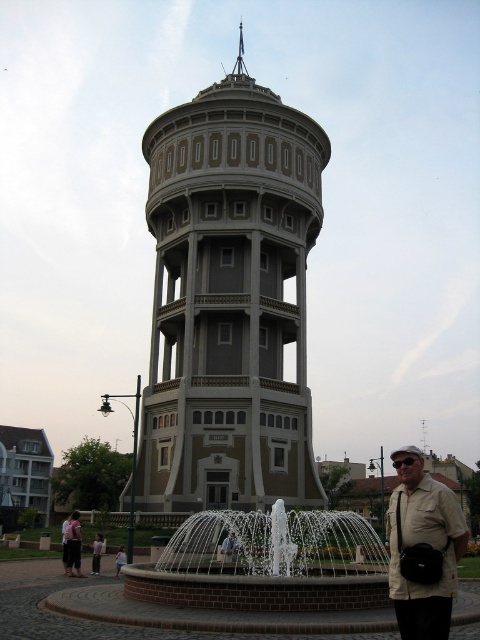
Question: Which is nearer to the light pink fabric dress at lower left?

Choices:
 (A) beige fabric shirt at lower right
 (B) white ceramic fountain at center
 (C) gray concrete tower at center

Answer: (B)

Question: Can you confirm if light pink fabric dress at lower left is positioned above light blue denim jeans at lower center?

Choices:
 (A) yes
 (B) no

Answer: (A)

Question: Does pink fabric dress at lower left appear under tan fabric shirt at center?

Choices:
 (A) no
 (B) yes

Answer: (B)

Question: Which of the following is the closest to the observer?

Choices:
 (A) (120, 557)
 (B) (98, 554)

Answer: (A)

Question: Based on their relative distances, which object is farther from the white ceramic fountain at center?

Choices:
 (A) tan fabric shirt at center
 (B) gray concrete tower at center

Answer: (B)

Question: Can you confirm if gray concrete tower at center is wider than white ceramic fountain at center?

Choices:
 (A) no
 (B) yes

Answer: (B)